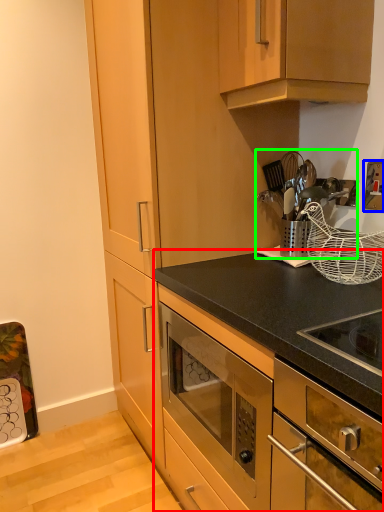
Question: Based on their relative distances, which object is farther from cabinetry (highlighted by a red box)? Choose from electric outlet (highlighted by a blue box) and appliance (highlighted by a green box).

Choices:
 (A) electric outlet
 (B) appliance

Answer: (A)